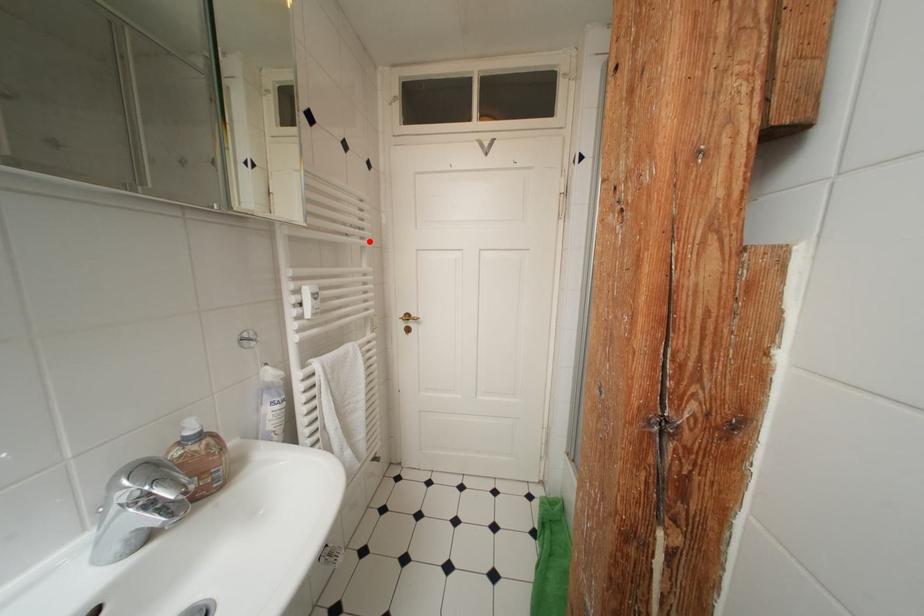
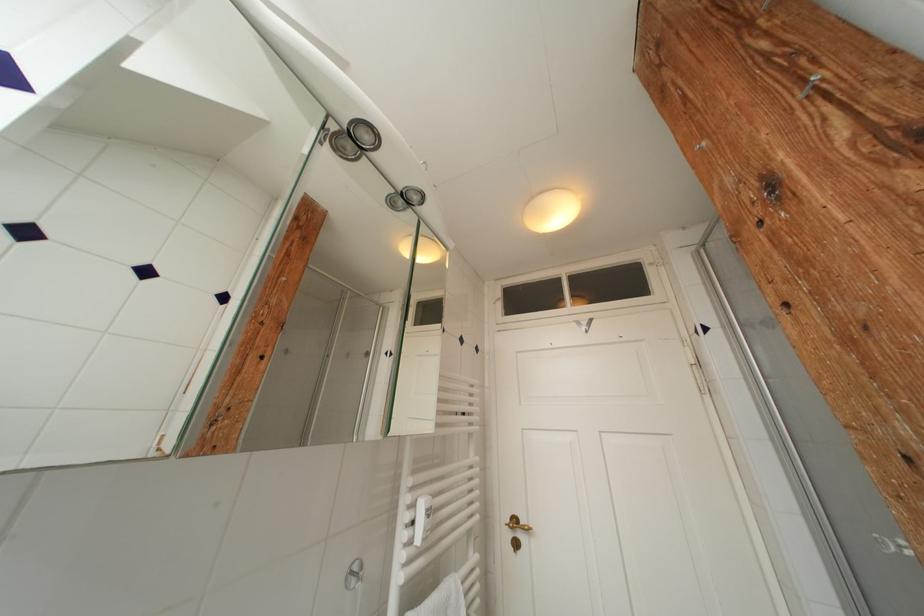
The point at the highlighted location is marked in the first image. Where is the corresponding point in the second image?

(478, 427)